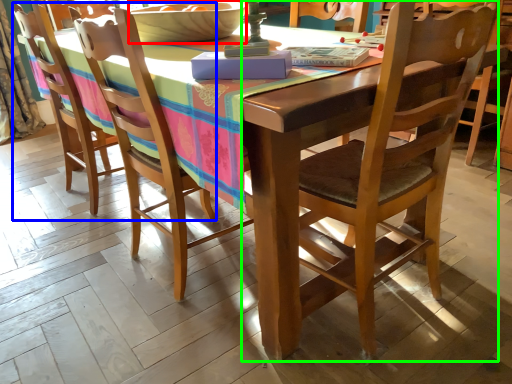
Question: Which object is the closest to the bowl (highlighted by a red box)? Choose among these: chair (highlighted by a blue box) or chair (highlighted by a green box).

Choices:
 (A) chair
 (B) chair

Answer: (A)